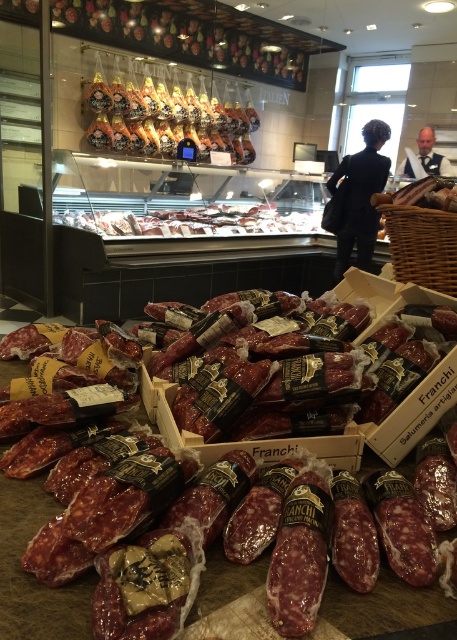
Question: Is shiny brown ham at upper center behind matte brown meat at center?

Choices:
 (A) yes
 (B) no

Answer: (A)

Question: Which object appears farthest from the camera in this image?

Choices:
 (A) shiny brown ham at upper center
 (B) matte brown meat at center

Answer: (A)

Question: Does shiny brown ham at upper center have a smaller size compared to matte brown meat at center?

Choices:
 (A) no
 (B) yes

Answer: (B)

Question: Which of the following is the closest to the observer?

Choices:
 (A) shiny brown ham at upper center
 (B) matte brown meat at center

Answer: (B)

Question: From the image, what is the correct spatial relationship of shiny brown ham at upper center in relation to matte brown meat at center?

Choices:
 (A) below
 (B) above

Answer: (B)

Question: Which point appears closest to the camera in this image?

Choices:
 (A) (99, 212)
 (B) (255, 115)

Answer: (A)